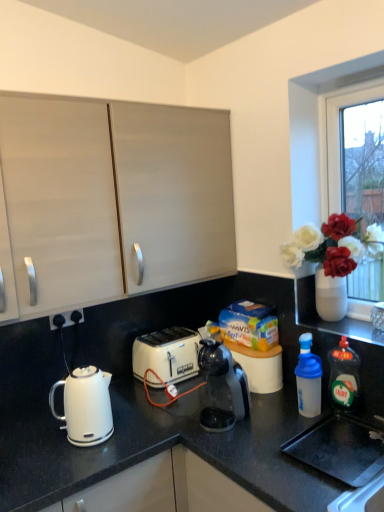
This screenshot has width=384, height=512. In order to click on vacant space situated above white glossy electric kettle at lower left (from a real-world perspective) in this screenshot , I will do `click(88, 440)`.